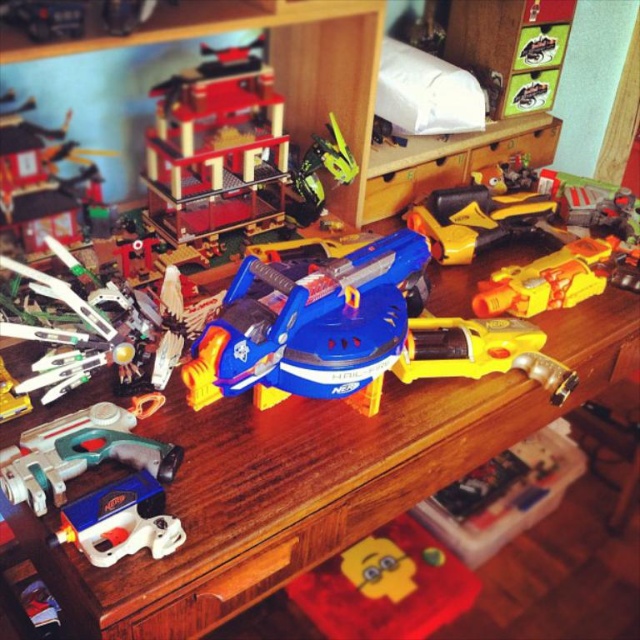
Question: Does wooden table at center have a greater width compared to yellow plastic toy gun at center-right?

Choices:
 (A) yes
 (B) no

Answer: (A)

Question: Which point is closer to the camera?

Choices:
 (A) (504, 202)
 (B) (157, 448)
 (C) (580, 250)

Answer: (B)

Question: Can you confirm if yellow plastic toy gun at center is positioned to the left of green plastic drill at lower left?

Choices:
 (A) no
 (B) yes

Answer: (A)

Question: Which point is closer to the camera?

Choices:
 (A) yellow plastic toy gun at center
 (B) blue plastic toy car at center

Answer: (B)

Question: Which of the following is the farthest from the observer?

Choices:
 (A) (321, 296)
 (B) (147, 580)
 (C) (548, 291)
 (D) (445, 244)

Answer: (D)

Question: Is blue plastic toy car at center thinner than yellow plastic toy gun at center-right?

Choices:
 (A) no
 (B) yes

Answer: (A)